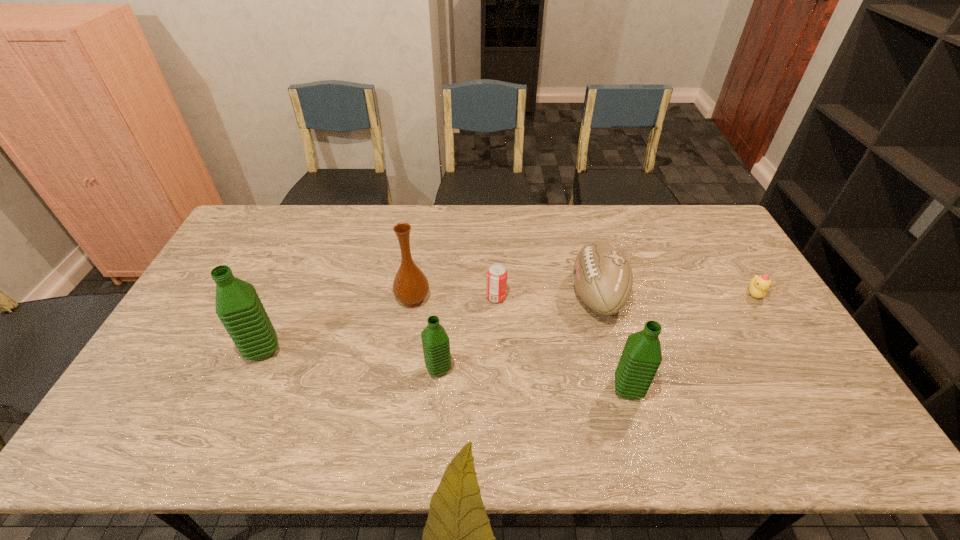
In order to click on vase in this screenshot , I will do `click(410, 286)`.

The width and height of the screenshot is (960, 540). Identify the location of vacant space located on the right of the tallest water bottle. (428, 350).

Identify the location of free space located on the left of the second water bottle from right to left. (304, 369).

Where is `free space located 0.200m on the right of the second shortest water bottle`? This screenshot has width=960, height=540. free space located 0.200m on the right of the second shortest water bottle is located at coordinates (722, 389).

The width and height of the screenshot is (960, 540). What are the coordinates of `free space located 0.070m on the front-facing side of the rightmost object` in the screenshot? It's located at (771, 322).

Find the location of `vacant space located on the back of the fourth object from right to left`. vacant space located on the back of the fourth object from right to left is located at coordinates (494, 241).

Image resolution: width=960 pixels, height=540 pixels. In order to click on vacant space located 0.230m on the laces of the football (American) in this screenshot , I will do `click(495, 295)`.

At what (x,y) coordinates should I click in order to perform the action: click on free space located 0.340m on the laces of the football (American). Please return your answer as a coordinate pair (x, y). This screenshot has width=960, height=540. Looking at the image, I should click on (460, 295).

Find the location of a particular element. The image size is (960, 540). free space located on the laces of the football (American) is located at coordinates (547, 295).

I want to click on vacant space located on the front of the sixth object from right to left, so click(x=405, y=347).